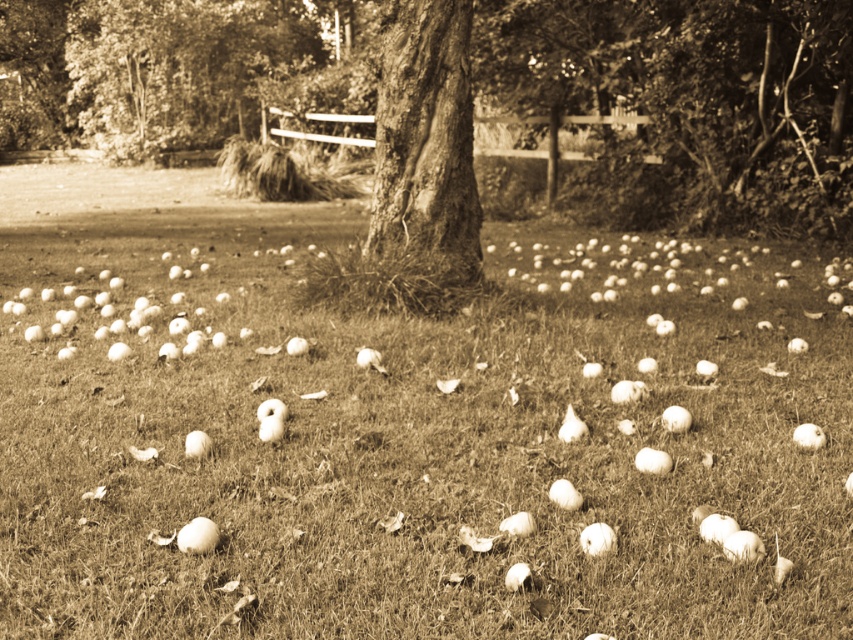
Which of these two, smooth grass at center or smooth bark tree at center, stands taller?

Standing taller between the two is smooth bark tree at center.

Does point (167, 550) come behind point (370, 205)?

No.

What are the coordinates of `smooth grass at center` in the screenshot? It's located at (415, 449).